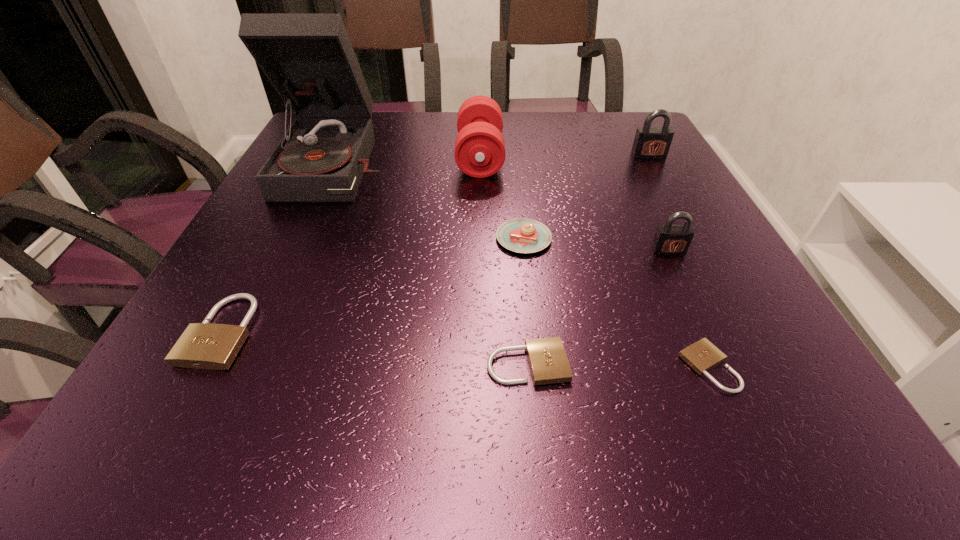
I want to click on free region at the far edge of the desktop, so click(x=541, y=122).

Where is `vacant position at the near edge of the desktop`? vacant position at the near edge of the desktop is located at coordinates (602, 446).

I want to click on vacant space at the left edge of the desktop, so click(284, 278).

The image size is (960, 540). I want to click on vacant space at the right edge of the desktop, so click(x=617, y=170).

Where is `free space at the far right corner`? free space at the far right corner is located at coordinates (612, 123).

The width and height of the screenshot is (960, 540). I want to click on vacant point located between the sixth tallest object and the fifth shortest object, so click(x=445, y=291).

Identify the location of vacant region between the biggest beige padlock and the fourth nearest padlock. Image resolution: width=960 pixels, height=540 pixels. (445, 291).

Find the location of `free spot between the fifth tallest object and the leftmost beige padlock`. free spot between the fifth tallest object and the leftmost beige padlock is located at coordinates (372, 285).

Where is `free space that is in between the dumbbell and the pastry`? The height and width of the screenshot is (540, 960). free space that is in between the dumbbell and the pastry is located at coordinates (502, 198).

The image size is (960, 540). In order to click on vacant area that lies between the second shortest padlock and the smallest beige padlock in this screenshot , I will do `click(618, 366)`.